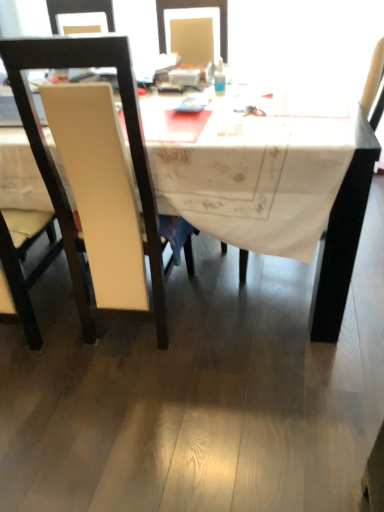
Locate an element on the screen. free space in front of translucent plastic bottle at upper center is located at coordinates (222, 103).